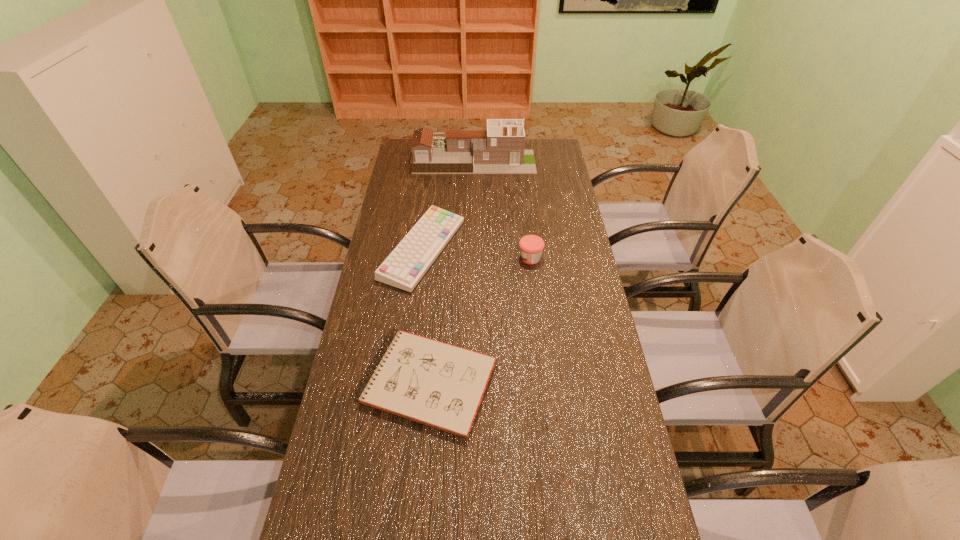
At what (x,y) coordinates should I click in order to perform the action: click on free spot at the left edge of the desktop. Please return your answer as a coordinate pair (x, y). Looking at the image, I should click on 409,190.

I want to click on vacant space at the right edge of the desktop, so click(x=589, y=430).

This screenshot has width=960, height=540. In order to click on vacant area between the nearest object and the third tallest object in this screenshot , I will do `click(425, 316)`.

Where is `vacant area that lies between the computer keyboard and the nearest object`? vacant area that lies between the computer keyboard and the nearest object is located at coordinates (425, 316).

At what (x,y) coordinates should I click in order to perform the action: click on free space between the shortest object and the tallest object. Please return your answer as a coordinate pair (x, y). The image size is (960, 540). Looking at the image, I should click on (450, 272).

Find the location of a particular element. This screenshot has width=960, height=540. free space between the computer keyboard and the shortest object is located at coordinates (425, 316).

I want to click on free space between the shortest object and the computer keyboard, so click(425, 316).

You are a GUI agent. You are given a task and a screenshot of the screen. Output one action in this format:
    pyautogui.click(x=<x>, y=<y>)
    Task: Click on the free area in between the tallest object and the third tallest object
    
    Given the screenshot: What is the action you would take?
    pyautogui.click(x=448, y=205)

At what (x,y) coordinates should I click in order to perform the action: click on vacant area that lies between the shortest object and the third tallest object. Please return your answer as a coordinate pair (x, y). Looking at the image, I should click on (425, 316).

Find the location of a particular element. Image resolution: width=960 pixels, height=540 pixels. the second closest object to the computer keyboard is located at coordinates (531, 246).